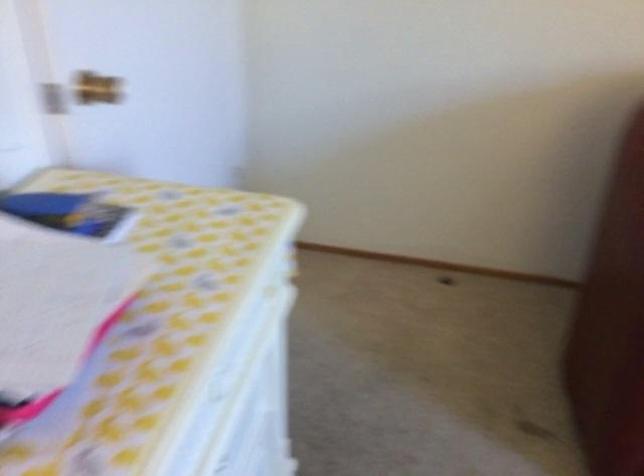
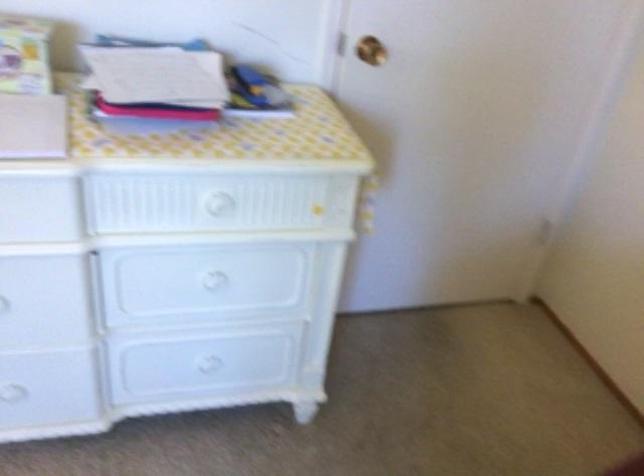
Find the pixel in the second image that matches the point at 216,356 in the first image.

(216, 203)